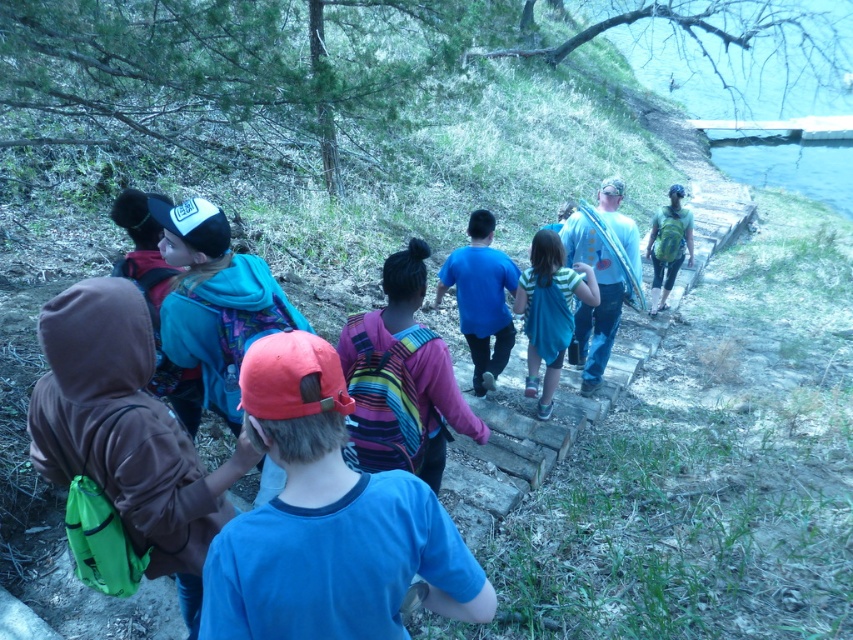
You are a photographer trying to capture a photo of the group on the wooden steps. You notice the striped backpack at center and the blue cotton shirt at center. Which object should you focus on first if you want to ensure both are in the frame without adjusting your camera angle?

The striped backpack at center has a lesser height compared to the blue cotton shirt at center, so you should focus on the blue cotton shirt at center first to ensure both are in the frame without adjusting your camera angle.

You are standing at the bottom of the wooden steps leading up the grassy slope. You need to find the striped backpack at center. According to the coordinates provided, where should you look relative to your position?

The striped backpack at center is located at coordinates point (402, 378), which means it is positioned slightly to the right and above your current position at the bottom of the steps.